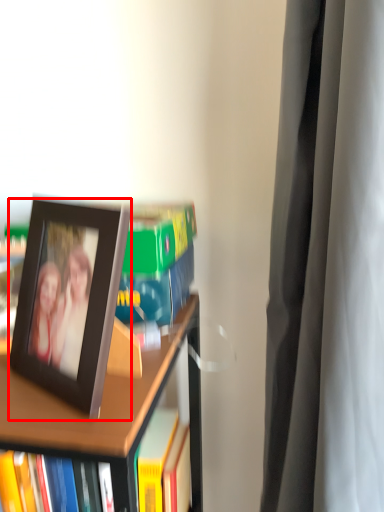
Question: Considering the relative positions of picture frame (annotated by the red box) and bookcase in the image provided, where is picture frame (annotated by the red box) located with respect to the staircase?

Choices:
 (A) right
 (B) left

Answer: (A)